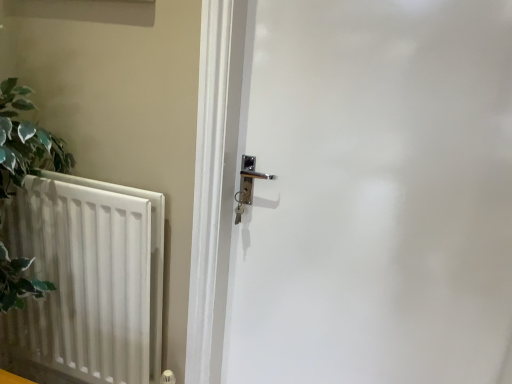
Question: Considering the positions of white matte radiator at left and white glossy door at center in the image, is white matte radiator at left wider or thinner than white glossy door at center?

Choices:
 (A) thin
 (B) wide

Answer: (A)

Question: Is white matte radiator at left spatially inside white glossy door at center, or outside of it?

Choices:
 (A) inside
 (B) outside

Answer: (B)

Question: Considering the positions of point (159, 342) and point (480, 97), is point (159, 342) closer or farther from the camera than point (480, 97)?

Choices:
 (A) farther
 (B) closer

Answer: (A)

Question: Based on their positions, is white glossy door at center located to the left or right of white matte radiator at left?

Choices:
 (A) right
 (B) left

Answer: (A)

Question: Is white glossy door at center taller or shorter than white matte radiator at left?

Choices:
 (A) tall
 (B) short

Answer: (A)

Question: From a real-world perspective, is white glossy door at center above or below white matte radiator at left?

Choices:
 (A) above
 (B) below

Answer: (A)

Question: Considering the positions of white glossy door at center and white matte radiator at left in the image, is white glossy door at center wider or thinner than white matte radiator at left?

Choices:
 (A) wide
 (B) thin

Answer: (A)